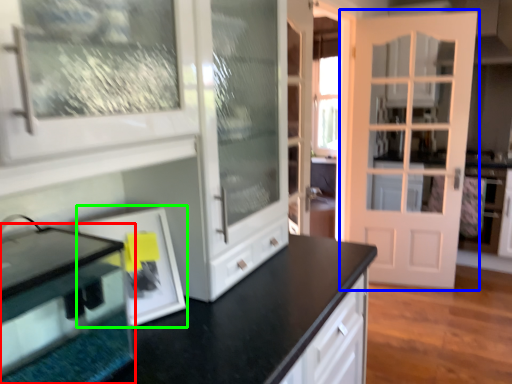
Question: Which object is the closest to the appliance (highlighted by a red box)? Choose among these: door (highlighted by a blue box) or picture frame (highlighted by a green box).

Choices:
 (A) door
 (B) picture frame

Answer: (B)